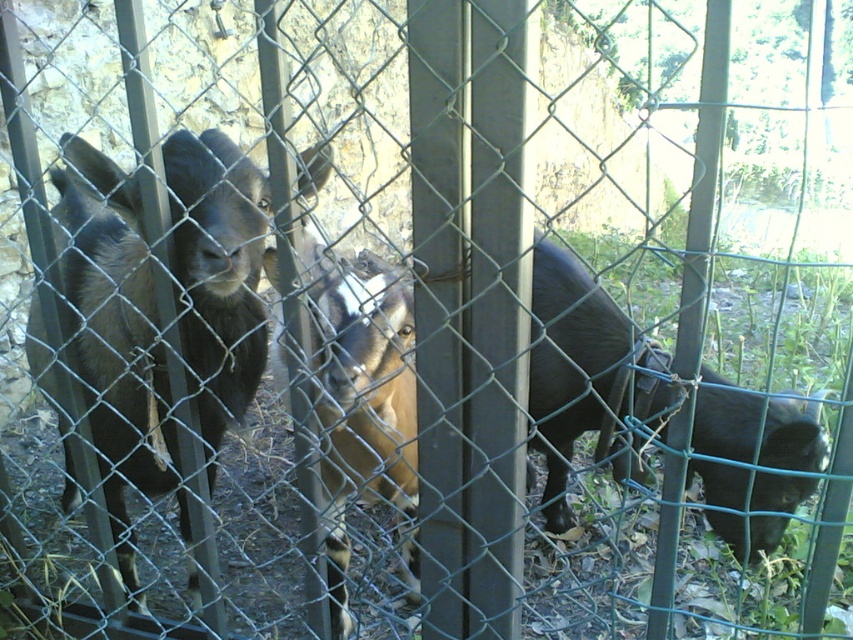
Question: Does dark brown fur goat at left appear on the left side of brown fuzzy goat at center?

Choices:
 (A) yes
 (B) no

Answer: (A)

Question: Among these objects, which one is farthest from the camera?

Choices:
 (A) brown fuzzy goat at center
 (B) dark brown fur goat at left

Answer: (B)

Question: Does dark brown fur goat at left appear on the right side of brown fuzzy goat at center?

Choices:
 (A) no
 (B) yes

Answer: (A)

Question: Does dark brown fur goat at left appear on the left side of brown fuzzy goat at center?

Choices:
 (A) no
 (B) yes

Answer: (B)

Question: Which point is farther to the camera?

Choices:
 (A) (134, 291)
 (B) (379, 260)

Answer: (B)